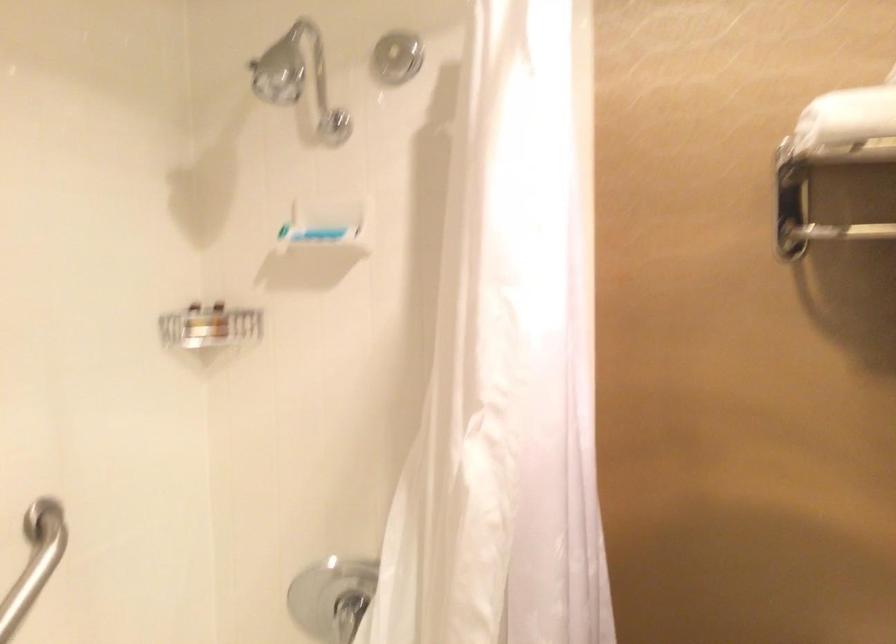
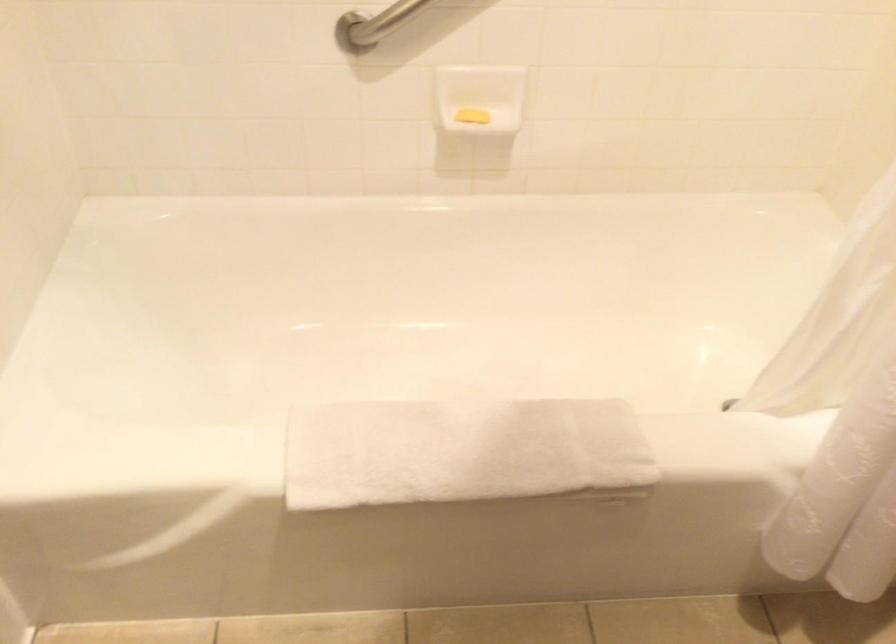
The images are taken continuously from a first-person perspective. In which direction is your viewpoint rotating?

The rotation direction of the camera is left-down.